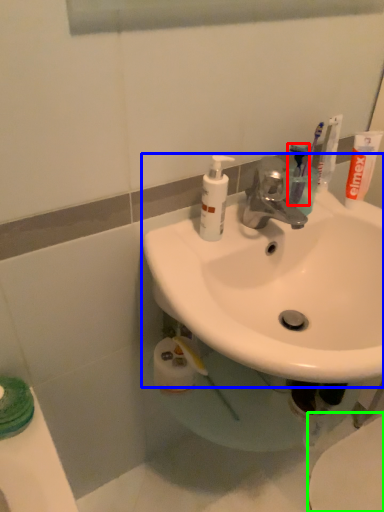
Question: Estimate the real-world distances between objects in this image. Which object is farther from toothbrush (highlighted by a red box), sink (highlighted by a blue box) or toilet (highlighted by a green box)?

Choices:
 (A) sink
 (B) toilet

Answer: (B)